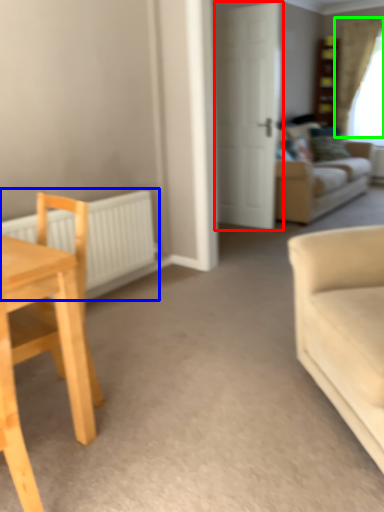
Question: Which is farther away from door (highlighted by a red box)? radiator (highlighted by a blue box) or curtain (highlighted by a green box)?

Choices:
 (A) radiator
 (B) curtain

Answer: (B)